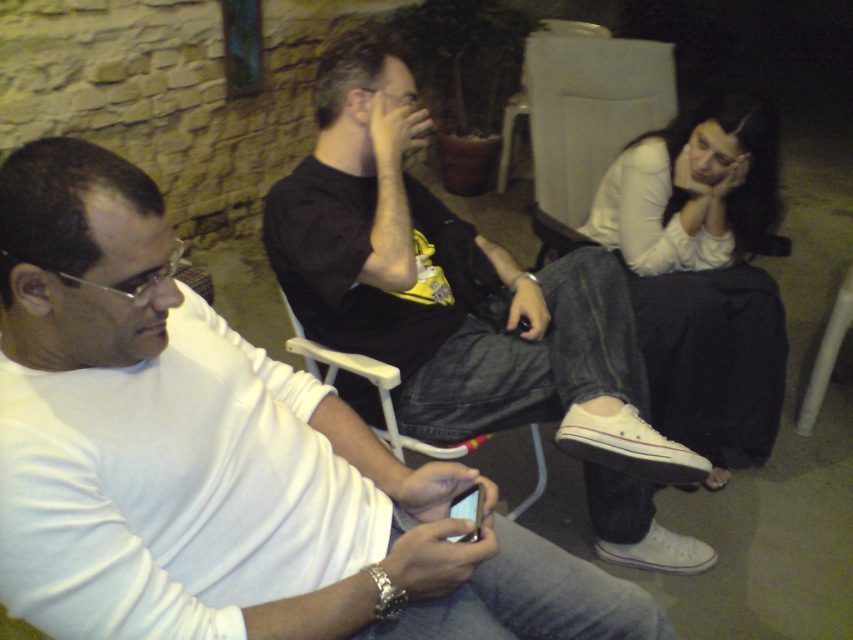
Question: Does white matte shirt at left appear on the right side of matte black smartphone at lower center?

Choices:
 (A) yes
 (B) no

Answer: (B)

Question: Which object appears closest to the camera in this image?

Choices:
 (A) black matte shirt at center
 (B) white matte shirt at lower right
 (C) white plastic chair at center
 (D) white matte shirt at left

Answer: (D)

Question: Is black matte shirt at center thinner than white matte shirt at lower right?

Choices:
 (A) no
 (B) yes

Answer: (A)

Question: Which of the following is the closest to the observer?

Choices:
 (A) (380, 384)
 (B) (350, 506)
 (C) (469, 504)

Answer: (B)

Question: Is white matte shirt at left thinner than matte black smartphone at lower center?

Choices:
 (A) yes
 (B) no

Answer: (B)

Question: Considering the real-world distances, which object is closest to the white matte shirt at lower right?

Choices:
 (A) black matte shirt at center
 (B) white matte shirt at left
 (C) white plastic chair at center

Answer: (A)